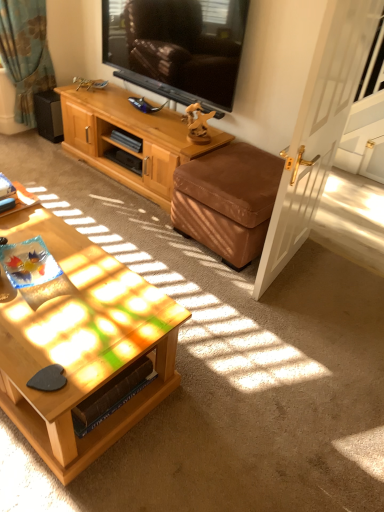
Image resolution: width=384 pixels, height=512 pixels. What are the coordinates of `vacant space to the left of black matte speaker at left` in the screenshot? It's located at point(31,136).